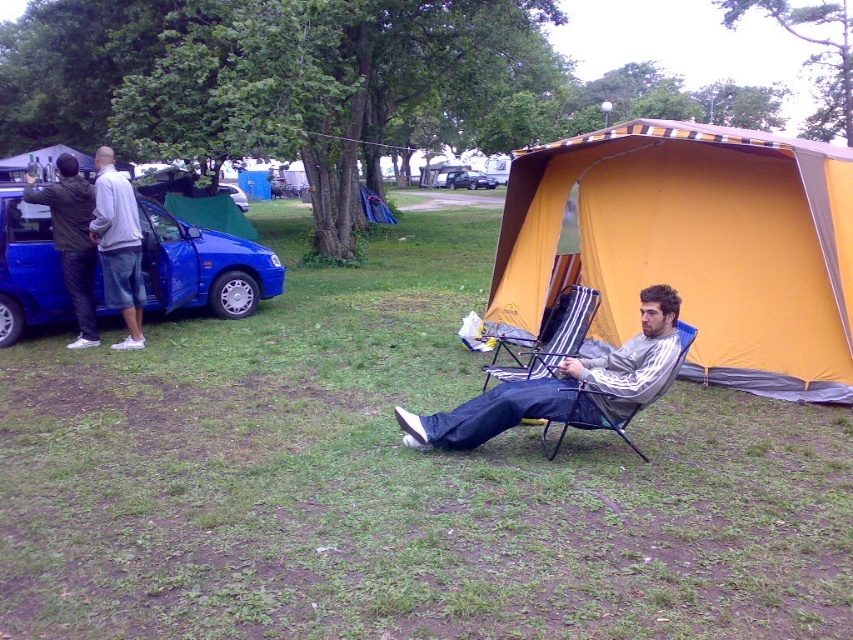
You are planning to set up a new tent next to the orange canvas tent at right and the blue matte car at left. Based on their sizes, which object should you consider first to ensure enough space?

The orange canvas tent at right might be wider than the blue matte car at left, so you should consider the orange canvas tent at right first to ensure there is sufficient space for both.

What is the object located at the coordinates point [566,387] in the image?

The point [566,387] corresponds to the gray striped shirt at center.

You are planning to set up a tent in this camping area. Based on the scene, can you determine if the orange canvas tent at right is positioned higher than the blue matte car at left?

The orange canvas tent at right is above the blue matte car at left, so yes, it is positioned higher.